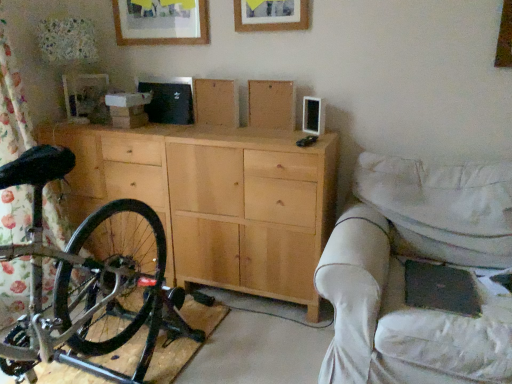
Question: Can you confirm if shiny black bicycle at left is smaller than white fabric couch at right?

Choices:
 (A) no
 (B) yes

Answer: (A)

Question: Is white fabric couch at right inside shiny black bicycle at left?

Choices:
 (A) yes
 (B) no

Answer: (B)

Question: Is shiny black bicycle at left positioned in front of white fabric couch at right?

Choices:
 (A) no
 (B) yes

Answer: (B)

Question: From a real-world perspective, does shiny black bicycle at left stand above white fabric couch at right?

Choices:
 (A) no
 (B) yes

Answer: (B)

Question: Could you tell me if shiny black bicycle at left is turned towards white fabric couch at right?

Choices:
 (A) no
 (B) yes

Answer: (A)

Question: Does point (156, 8) appear closer or farther from the camera than point (218, 142)?

Choices:
 (A) farther
 (B) closer

Answer: (A)

Question: Choose the correct answer: Is wooden picture frame at upper center, the 2th picture frame in the right-to-left sequence, inside natural wood cabinet at center or outside it?

Choices:
 (A) inside
 (B) outside

Answer: (B)

Question: In terms of size, does wooden picture frame at upper center, which is counted as the second picture frame, starting from the front, appear bigger or smaller than natural wood cabinet at center?

Choices:
 (A) small
 (B) big

Answer: (A)

Question: From the image's perspective, is wooden picture frame at upper center, which is the 1th picture frame in left-to-right order, located above or below natural wood cabinet at center?

Choices:
 (A) above
 (B) below

Answer: (A)

Question: In terms of height, does white fabric couch at right look taller or shorter compared to wooden picture frame at upper center, marked as the second picture frame in a left-to-right arrangement?

Choices:
 (A) short
 (B) tall

Answer: (B)

Question: Relative to wooden picture frame at upper center, marked as the second picture frame in a left-to-right arrangement, is white fabric couch at right in front or behind?

Choices:
 (A) front
 (B) behind

Answer: (A)

Question: Is white fabric couch at right wider or thinner than wooden picture frame at upper center, marked as the second picture frame in a left-to-right arrangement?

Choices:
 (A) thin
 (B) wide

Answer: (B)

Question: From the image's perspective, is white fabric couch at right above or below wooden picture frame at upper center, which is counted as the 1th picture frame, starting from the right?

Choices:
 (A) below
 (B) above

Answer: (A)

Question: Do you think natural wood cabinet at center is within white fabric couch at right, or outside of it?

Choices:
 (A) inside
 (B) outside

Answer: (B)

Question: Considering the positions of point pyautogui.click(x=285, y=203) and point pyautogui.click(x=380, y=208), is point pyautogui.click(x=285, y=203) closer or farther from the camera than point pyautogui.click(x=380, y=208)?

Choices:
 (A) farther
 (B) closer

Answer: (A)